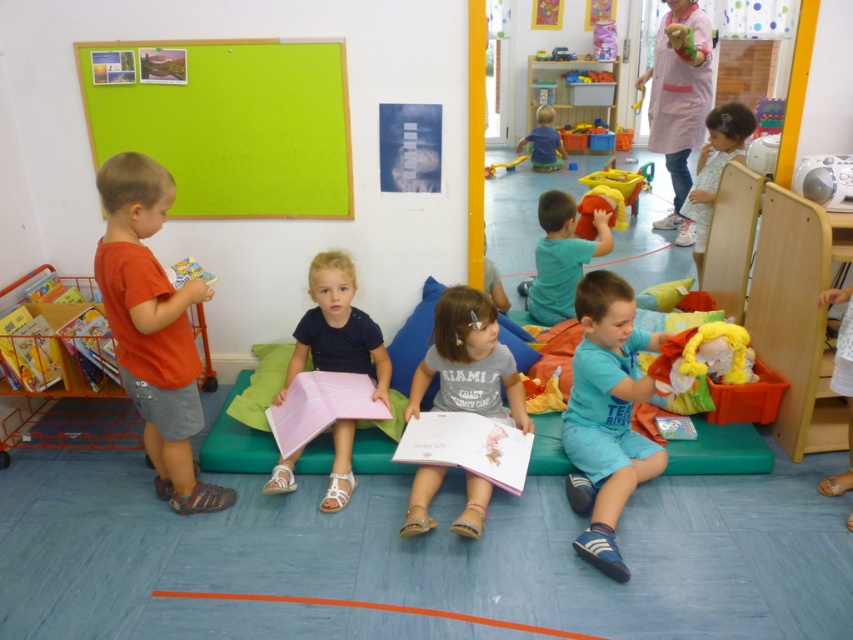
Does pink paper at center appear on the left side of teal matte shirt at center?

Correct, you'll find pink paper at center to the left of teal matte shirt at center.

Find the location of a particular element. pink paper at center is located at coordinates (337, 328).

Between point (338, 312) and point (561, 284), which one is positioned behind?

Point (561, 284)

This screenshot has height=640, width=853. In order to click on pink paper at center in this screenshot , I will do `click(337, 328)`.

Is soft plush toy at center thinner than blue fabric at center?

Yes, soft plush toy at center is thinner than blue fabric at center.

What do you see at coordinates (608, 196) in the screenshot? The width and height of the screenshot is (853, 640). I see `soft plush toy at center` at bounding box center [608, 196].

Is point (616, 192) positioned behind point (531, 157)?

No, it is in front of (531, 157).

Find the location of `soft plush toy at center`. soft plush toy at center is located at coordinates (608, 196).

Image resolution: width=853 pixels, height=640 pixels. What do you see at coordinates (468, 362) in the screenshot?
I see `matte pink book at center` at bounding box center [468, 362].

Can you confirm if matte pink book at center is positioned below plush yellow doll at upper right?

Indeed, matte pink book at center is positioned under plush yellow doll at upper right.

This screenshot has height=640, width=853. I want to click on matte pink book at center, so click(x=468, y=362).